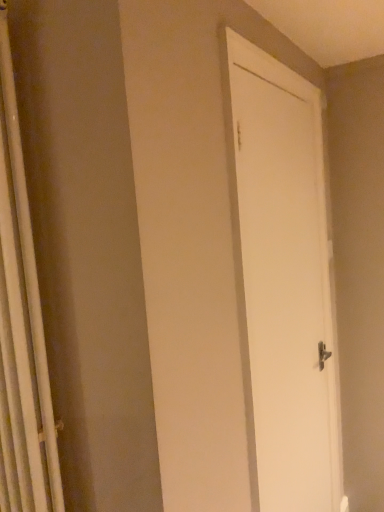
This screenshot has width=384, height=512. Describe the element at coordinates (21, 329) in the screenshot. I see `white fabric shower curtain at left` at that location.

Measure the distance between white fabric shower curtain at left and camera.

The depth of white fabric shower curtain at left is 33.50 inches.

Where is `white fabric shower curtain at left`? This screenshot has height=512, width=384. white fabric shower curtain at left is located at coordinates (21, 329).

Identify the location of white matte door at center. The height and width of the screenshot is (512, 384). (283, 282).

Consider the image. Measure the distance between point (241,314) and camera.

They are 1.15 meters apart.

Describe the element at coordinates (283, 282) in the screenshot. I see `white matte door at center` at that location.

Find the location of a particular element. This screenshot has width=384, height=512. white fabric shower curtain at left is located at coordinates [x=21, y=329].

Would you say white matte door at center is to the left or to the right of white fabric shower curtain at left in the picture?

white matte door at center is positioned on white fabric shower curtain at left's right side.

Which object is further away from the camera, white matte door at center or white fabric shower curtain at left?

white matte door at center is more distant.

Is point (282, 248) positioned in front of point (39, 319)?

No, it is behind (39, 319).

From the image's perspective, is white matte door at center positioned above or below white fabric shower curtain at left?

white matte door at center is below white fabric shower curtain at left.

From a real-world perspective, which object stands above the other?

white fabric shower curtain at left, from a real-world perspective.

Between white matte door at center and white fabric shower curtain at left, which one has smaller width?

With smaller width is white matte door at center.

Can you confirm if white matte door at center is shorter than white fabric shower curtain at left?

No, white matte door at center is not shorter than white fabric shower curtain at left.

Based on the photo, considering the relative sizes of white matte door at center and white fabric shower curtain at left in the image provided, is white matte door at center bigger than white fabric shower curtain at left?

Yes.

Would you say white matte door at center is inside or outside white fabric shower curtain at left?

white matte door at center exists outside the volume of white fabric shower curtain at left.

Would you consider white matte door at center to be distant from white fabric shower curtain at left?

No, there isn't a large distance between white matte door at center and white fabric shower curtain at left.

Consider the image. Is white fabric shower curtain at left at the back of white matte door at center?

No, white matte door at center is not facing away from white fabric shower curtain at left.

How different are the orientations of white matte door at center and white fabric shower curtain at left in degrees?

They differ by 90.6 degrees in their facing directions.

How distant is white matte door at center from white fabric shower curtain at left?

They are 30.05 inches apart.

Where is `door lying below the white fabric shower curtain at left (from the image's perspective)`? The height and width of the screenshot is (512, 384). door lying below the white fabric shower curtain at left (from the image's perspective) is located at coordinates (283, 282).

Which object is positioned more to the right, white fabric shower curtain at left or white matte door at center?

A: From the viewer's perspective, white matte door at center appears more on the right side.

Is white fabric shower curtain at left in front of or behind white matte door at center in the image?

In the image, white fabric shower curtain at left appears in front of white matte door at center.

Which is closer, (33, 448) or (298, 280)?

The point (33, 448) is closer to the camera.

From the image's perspective, is white fabric shower curtain at left beneath white matte door at center?

No.

From a real-world perspective, between white fabric shower curtain at left and white matte door at center, who is vertically higher?

white fabric shower curtain at left, from a real-world perspective.

Considering the sizes of objects white fabric shower curtain at left and white matte door at center in the image provided, who is wider, white fabric shower curtain at left or white matte door at center?

Wider between the two is white fabric shower curtain at left.

From their relative heights in the image, would you say white fabric shower curtain at left is taller or shorter than white matte door at center?

In the image, white fabric shower curtain at left appears to be shorter than white matte door at center.

Does white fabric shower curtain at left have a smaller size compared to white matte door at center?

Yes.

Could white matte door at center be considered to be inside white fabric shower curtain at left?

No, white matte door at center is located outside of white fabric shower curtain at left.

Is white fabric shower curtain at left far away from white matte door at center?

Actually, white fabric shower curtain at left and white matte door at center are a little close together.

Is white fabric shower curtain at left looking in the opposite direction of white matte door at center?

No, white fabric shower curtain at left's orientation is not away from white matte door at center.

The width and height of the screenshot is (384, 512). What are the coordinates of `door below the white fabric shower curtain at left (from the image's perspective)` in the screenshot? It's located at (283, 282).

The width and height of the screenshot is (384, 512). In order to click on door that appears below the white fabric shower curtain at left (from a real-world perspective) in this screenshot , I will do `click(283, 282)`.

The image size is (384, 512). In the image, there is a white matte door at center. What are the coordinates of `shower curtain above it (from the image's perspective)` in the screenshot? It's located at (21, 329).